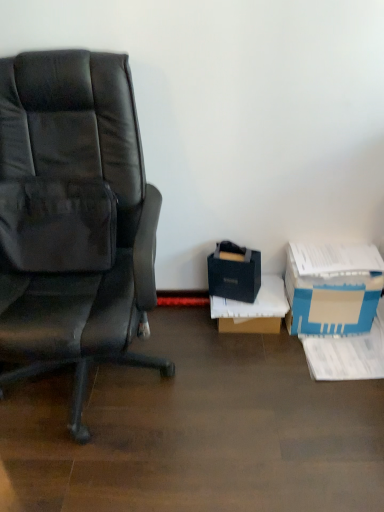
I want to click on blank space situated above black matte box at lower right, which is the 2th box from left to right (from a real-world perspective), so click(x=250, y=295).